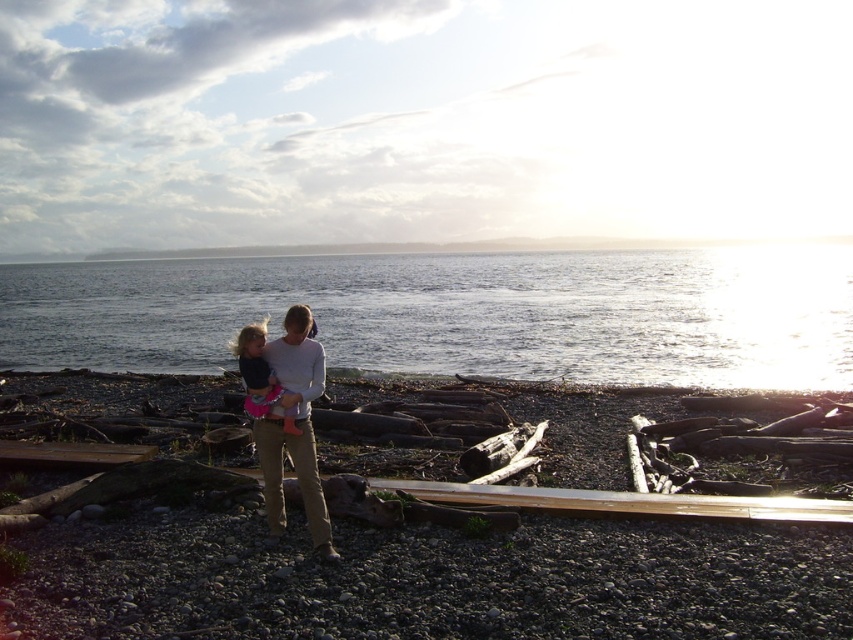
Question: Among these points, which one is farthest from the camera?

Choices:
 (A) (596, 474)
 (B) (79, 328)

Answer: (B)

Question: Estimate the real-world distances between objects in this image. Which object is closer to the clear water at center?

Choices:
 (A) light gray cotton sweater at center
 (B) smooth gravel beach at center
 (C) matte pink skirt at center

Answer: (B)

Question: Is clear water at center closer to the viewer compared to light gray cotton sweater at center?

Choices:
 (A) yes
 (B) no

Answer: (B)

Question: Considering the real-world distances, which object is closest to the smooth gravel beach at center?

Choices:
 (A) matte pink skirt at center
 (B) clear water at center
 (C) light gray cotton sweater at center

Answer: (C)

Question: Observing the image, what is the correct spatial positioning of smooth gravel beach at center in reference to clear water at center?

Choices:
 (A) right
 (B) left

Answer: (B)

Question: From the image, what is the correct spatial relationship of clear water at center in relation to matte pink skirt at center?

Choices:
 (A) below
 (B) above

Answer: (B)